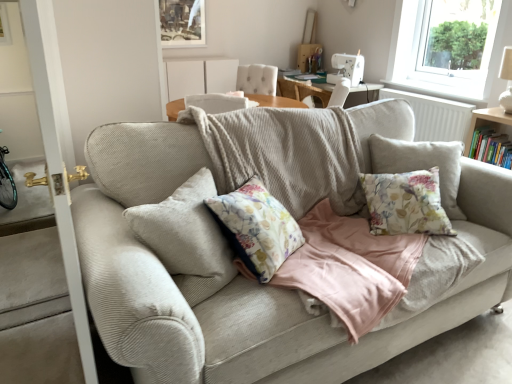
Question: From a real-world perspective, relative to white tufted armchair at upper center, is hardcover book at right vertically above or below?

Choices:
 (A) below
 (B) above

Answer: (A)

Question: Considering the positions of hardcover book at right and white tufted armchair at upper center in the image, is hardcover book at right wider or thinner than white tufted armchair at upper center?

Choices:
 (A) thin
 (B) wide

Answer: (A)

Question: Considering the real-world distances, which object is farthest from the corduroy couch at center?

Choices:
 (A) hardcover book at right
 (B) transparent glass window at upper right
 (C) white tufted armchair at upper center
 (D) matte wooden picture frame at upper center
 (E) white textured radiator at upper right

Answer: (B)

Question: Which object is the farthest from the hardcover book at right?

Choices:
 (A) white textured radiator at upper right
 (B) corduroy couch at center
 (C) matte wooden picture frame at upper center
 (D) transparent glass window at upper right
 (E) white tufted armchair at upper center

Answer: (D)